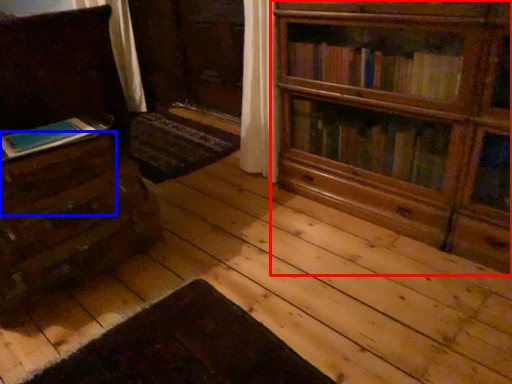
Question: Which of the following is the farthest to the observer, bookcase (highlighted by a red box) or drawer (highlighted by a blue box)?

Choices:
 (A) bookcase
 (B) drawer

Answer: (B)